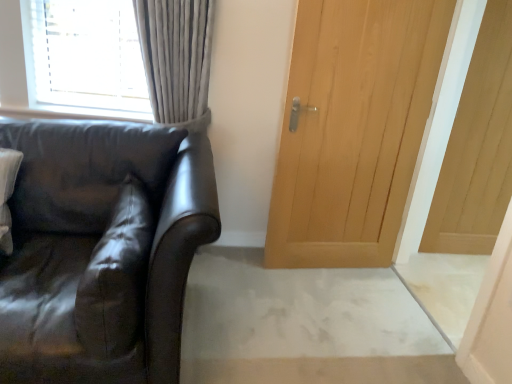
Question: Considering the relative sizes of light wood door at center, the 1th door positioned from the left, and matte black leather couch at left in the image provided, is light wood door at center, the 1th door positioned from the left, bigger than matte black leather couch at left?

Choices:
 (A) no
 (B) yes

Answer: (A)

Question: Is matte black leather couch at left located within light wood door at center, the 1th door positioned from the left?

Choices:
 (A) no
 (B) yes

Answer: (A)

Question: Are light wood door at center, acting as the 2th door starting from the right, and matte black leather couch at left making contact?

Choices:
 (A) yes
 (B) no

Answer: (B)

Question: Is light wood door at center, acting as the 2th door starting from the right, facing away from matte black leather couch at left?

Choices:
 (A) no
 (B) yes

Answer: (A)

Question: Considering the relative positions of light wood door at center, the 1th door positioned from the left, and matte black leather couch at left in the image provided, is light wood door at center, the 1th door positioned from the left, to the right of matte black leather couch at left from the viewer's perspective?

Choices:
 (A) no
 (B) yes

Answer: (B)

Question: From the image's perspective, does light wood door at center, acting as the 2th door starting from the right, appear lower than matte black leather couch at left?

Choices:
 (A) no
 (B) yes

Answer: (A)

Question: Is light wood door at center, the 1th door positioned from the left, positioned in front of light wood paneling at right, positioned as the 1th door in right-to-left order?

Choices:
 (A) yes
 (B) no

Answer: (A)

Question: Are light wood door at center, acting as the 2th door starting from the right, and light wood paneling at right, positioned as the 1th door in right-to-left order, beside each other?

Choices:
 (A) no
 (B) yes

Answer: (A)

Question: Could you tell me if light wood door at center, acting as the 2th door starting from the right, is turned towards light wood paneling at right, which is the 2th door in left-to-right order?

Choices:
 (A) yes
 (B) no

Answer: (B)

Question: Is light wood door at center, the 1th door positioned from the left, taller than light wood paneling at right, which is the 2th door in left-to-right order?

Choices:
 (A) no
 (B) yes

Answer: (A)

Question: Is light wood door at center, acting as the 2th door starting from the right, facing away from light wood paneling at right, positioned as the 1th door in right-to-left order?

Choices:
 (A) no
 (B) yes

Answer: (A)

Question: Is light wood door at center, the 1th door positioned from the left, to the left of light wood paneling at right, which is the 2th door in left-to-right order, from the viewer's perspective?

Choices:
 (A) yes
 (B) no

Answer: (A)

Question: From the image's perspective, is suede-like brown pillow at left on light wood paneling at right, which is the 2th door in left-to-right order?

Choices:
 (A) yes
 (B) no

Answer: (B)